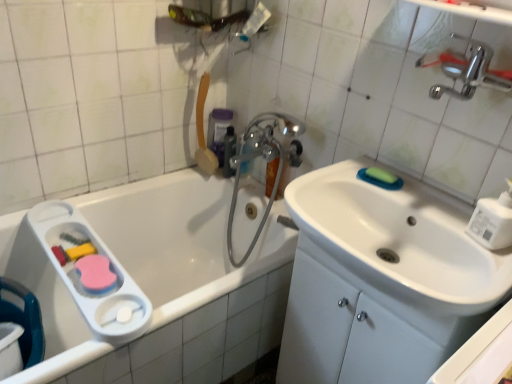
Question: From the image's perspective, relative to chrome metallic faucet at upper center, is semi-transparent plastic bottle at upper center, which ranks as the first mouthwash in front-to-back order, above or below?

Choices:
 (A) above
 (B) below

Answer: (A)

Question: Is semi-transparent plastic bottle at upper center, which ranks as the first mouthwash in front-to-back order, in front of or behind chrome metallic faucet at upper center in the image?

Choices:
 (A) behind
 (B) front

Answer: (A)

Question: Which object is the closest to the polished chrome faucet at upper right?

Choices:
 (A) green matte soap at upper right
 (B) chrome metallic faucet at upper center
 (C) white plastic soap dispenser at right
 (D) white glossy sink at center right
 (E) purple plastic mouthwash at upper center, the second mouthwash when ordered from front to back

Answer: (C)

Question: Estimate the real-world distances between objects in this image. Which object is closer to the purple plastic mouthwash at upper center, the second mouthwash when ordered from front to back?

Choices:
 (A) polished chrome faucet at upper right
 (B) green matte soap at upper right
 (C) white plastic soap dispenser at right
 (D) semi-transparent plastic bottle at upper center, which ranks as the first mouthwash in front-to-back order
 (E) white glossy sink at center right

Answer: (D)